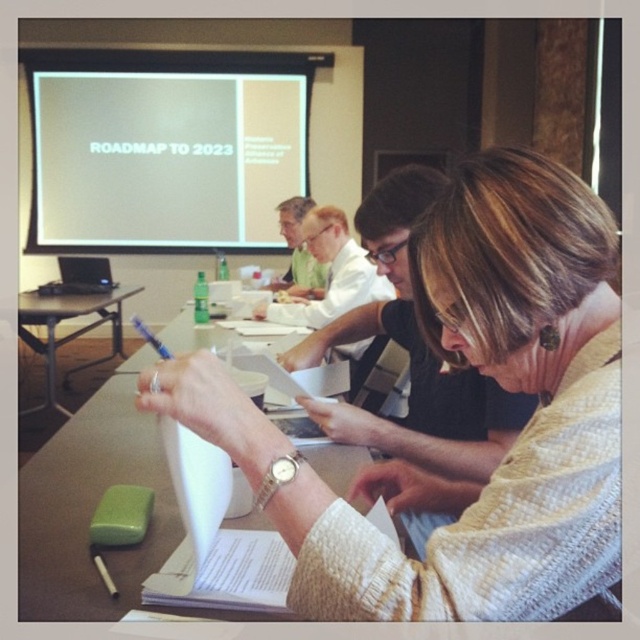
Question: Based on their relative distances, which object is farther from the blue plastic pen at center?

Choices:
 (A) green plastic table at left
 (B) white knitted sweater at center
 (C) white paper at center

Answer: (A)

Question: Among these points, which one is nearest to the camera?

Choices:
 (A) (422, 269)
 (B) (106, 109)

Answer: (A)

Question: Which point appears farthest from the camera in this image?

Choices:
 (A) (189, 413)
 (B) (364, 292)

Answer: (B)

Question: Can you confirm if white knitted sweater at center is thinner than green plastic table at left?

Choices:
 (A) no
 (B) yes

Answer: (B)

Question: Can you confirm if white paper at center is smaller than blue plastic pen at center?

Choices:
 (A) no
 (B) yes

Answer: (B)

Question: Does white knitted sweater at center have a greater width compared to white paper at center?

Choices:
 (A) no
 (B) yes

Answer: (A)